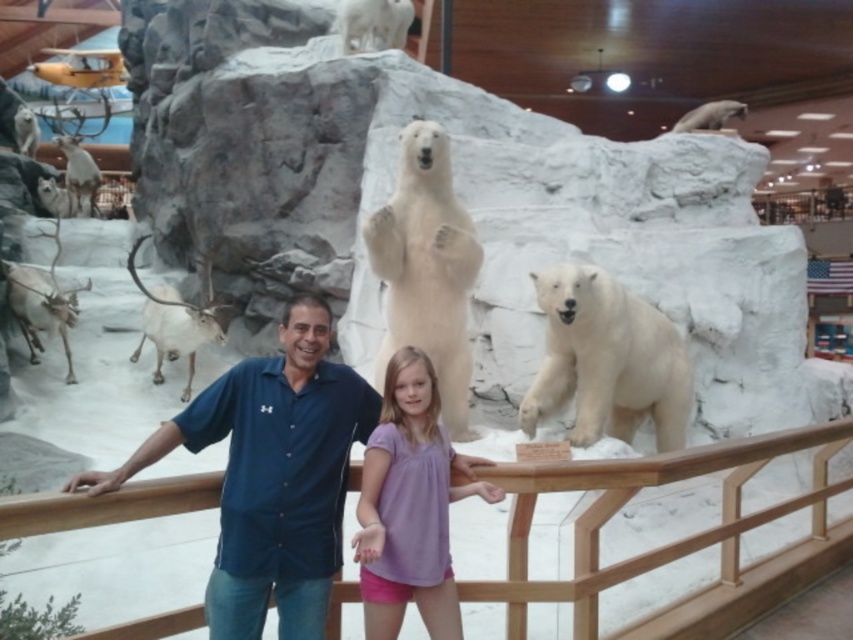
You are a visitor at the Arctic exhibit. You see the wooden at center and the white fur polar bear at right. Which object is positioned lower in the scene?

The wooden at center is positioned lower than the white fur polar bear at right.

You are a museum visitor standing in front of the exhibit. You notice the blue cotton shirt at center and the wooden at center. Which object is wider?

The blue cotton shirt at center is wider than the wooden at center.

You are a museum guide who needs to ensure visitors stay behind the railing. You notice the blue cotton shirt at center and the wooden at center. Which object is closer to the railing?

The blue cotton shirt at center is closer to the railing because it has a larger size compared to the wooden at center, making it extend nearer to the barrier.